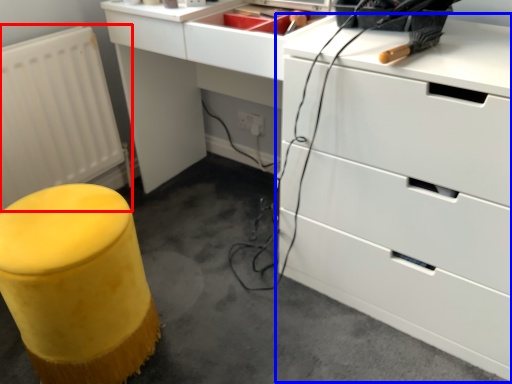
Question: Which point is closer to the camera, radiator (highlighted by a red box) or chest of drawers (highlighted by a blue box)?

Choices:
 (A) radiator
 (B) chest of drawers

Answer: (B)